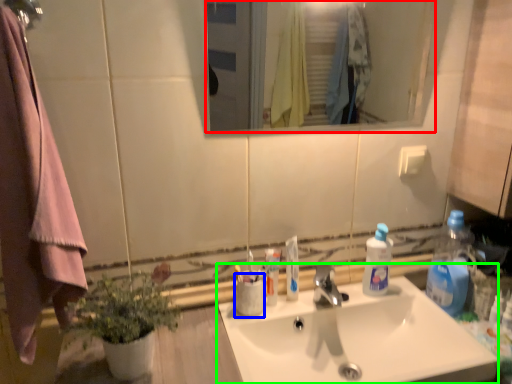
Question: Based on their relative distances, which object is nearer to mirror (highlighted by a red box)? Choose from coffee cup (highlighted by a blue box) and sink (highlighted by a green box).

Choices:
 (A) coffee cup
 (B) sink

Answer: (B)